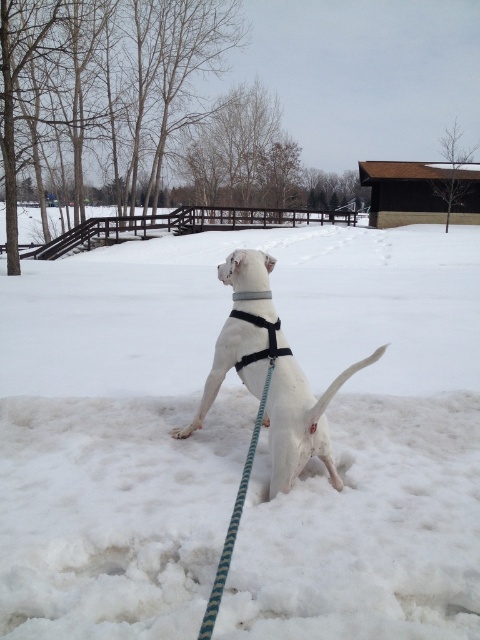
You are a photographer trying to capture the white fluffy snow at center and the white matte harness at center in a single shot. Based on their positions, which object will appear larger in the photo?

The white fluffy snow at center will appear larger in the photo because it is closer to the viewer than the white matte harness at center.